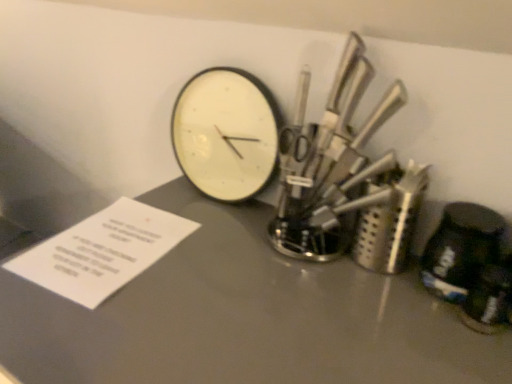
Question: Should I look upward or downward to see white matte wall clock at center?

Choices:
 (A) up
 (B) down

Answer: (A)

Question: Does polished metal knife set at upper right appear on the left side of white matte wall clock at center?

Choices:
 (A) yes
 (B) no

Answer: (B)

Question: Does polished metal knife set at upper right have a smaller size compared to white matte wall clock at center?

Choices:
 (A) no
 (B) yes

Answer: (A)

Question: Is polished metal knife set at upper right oriented away from white matte wall clock at center?

Choices:
 (A) yes
 (B) no

Answer: (B)

Question: From a real-world perspective, is polished metal knife set at upper right positioned under white matte wall clock at center based on gravity?

Choices:
 (A) yes
 (B) no

Answer: (B)

Question: Is the position of polished metal knife set at upper right less distant than that of white matte wall clock at center?

Choices:
 (A) yes
 (B) no

Answer: (A)

Question: From the image's perspective, is polished metal knife set at upper right under white matte wall clock at center?

Choices:
 (A) yes
 (B) no

Answer: (A)

Question: From the image's perspective, is polished metal knife set at upper right beneath white paper at lower left?

Choices:
 (A) yes
 (B) no

Answer: (B)

Question: From a real-world perspective, is polished metal knife set at upper right located beneath white paper at lower left?

Choices:
 (A) no
 (B) yes

Answer: (A)

Question: From a real-world perspective, is polished metal knife set at upper right on white paper at lower left?

Choices:
 (A) no
 (B) yes

Answer: (B)

Question: Is polished metal knife set at upper right not close to white paper at lower left?

Choices:
 (A) yes
 (B) no

Answer: (B)

Question: Is polished metal knife set at upper right aimed at white paper at lower left?

Choices:
 (A) yes
 (B) no

Answer: (B)

Question: From the image's perspective, is polished metal knife set at upper right located above white paper at lower left?

Choices:
 (A) yes
 (B) no

Answer: (A)

Question: Does polished metal knife set at upper right have a greater height compared to matte gray table at center?

Choices:
 (A) no
 (B) yes

Answer: (A)